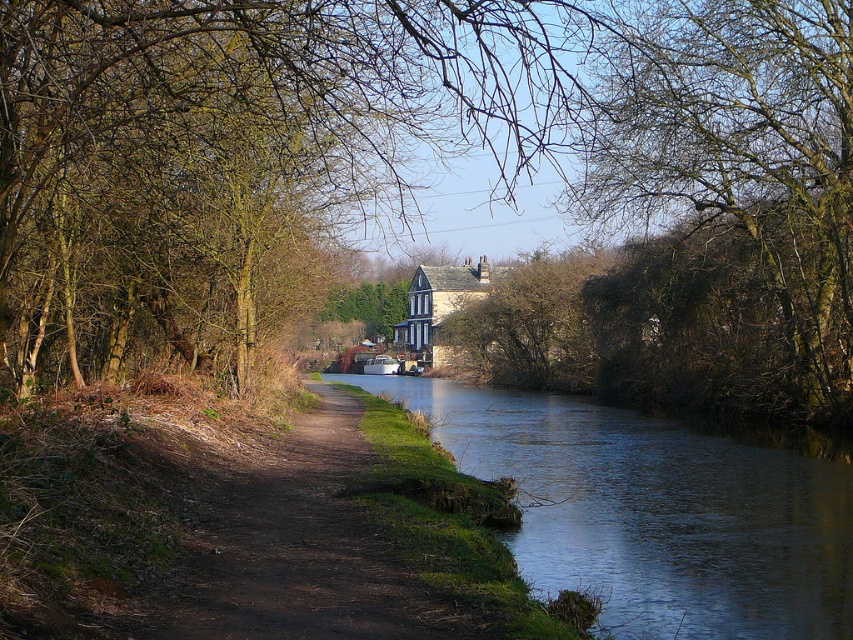
You are a hiker trying to cross the canal using the brown dirt path at center. Based on the scene, can you safely walk on the dark blue water at center to reach the path?

No, you cannot walk on the dark blue water at center because it is located below the brown dirt path at center, meaning the water is under the path and not accessible for walking.

You are a hiker walking along the brown dirt path at center. You notice the bare branches at center above you. Can you stand up straight without hitting your head on the branches?

The bare branches at center are taller than the brown dirt path at center, so there should be enough clearance for you to stand up straight without hitting your head on them.